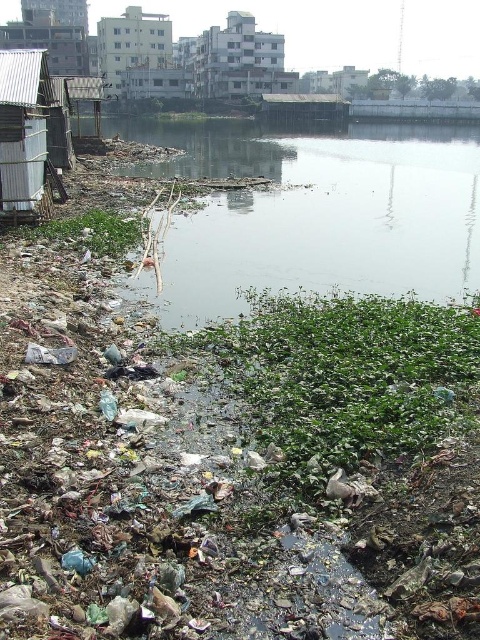
Question: Does metal corrugated hut at left have a greater width compared to white matte building at upper center?

Choices:
 (A) no
 (B) yes

Answer: (A)

Question: Is metal corrugated hut at left in front of white matte building at upper center?

Choices:
 (A) no
 (B) yes

Answer: (B)

Question: Which of the following is the closest to the observer?

Choices:
 (A) (151, 13)
 (B) (4, 168)
 (C) (412, 150)
 (D) (196, 77)

Answer: (B)

Question: Based on their relative distances, which object is farther from the metal corrugated hut at left?

Choices:
 (A) white matte building at upper center
 (B) white concrete building at upper center

Answer: (A)

Question: Which object appears farthest from the camera in this image?

Choices:
 (A) white concrete building at upper center
 (B) white matte building at upper center
 (C) metal corrugated hut at left

Answer: (B)

Question: Where is dirty plastic debris at lower left located in relation to white concrete building at upper center in the image?

Choices:
 (A) above
 (B) below

Answer: (B)